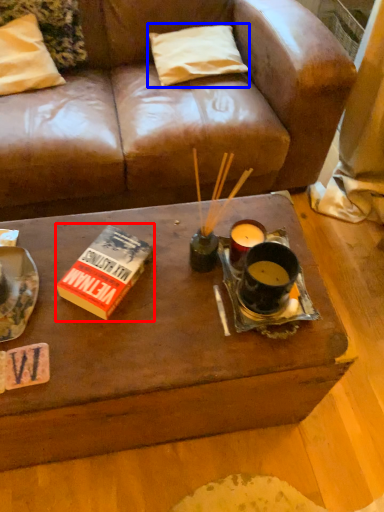
Question: Which object appears farthest to the camera in this image, paperback book (highlighted by a red box) or pillow (highlighted by a blue box)?

Choices:
 (A) paperback book
 (B) pillow

Answer: (B)